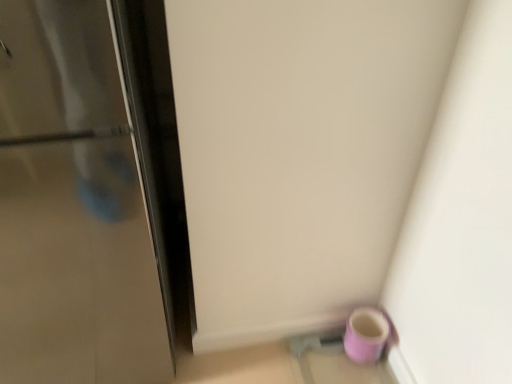
Image resolution: width=512 pixels, height=384 pixels. I want to click on matte purple mug at lower right, so click(x=365, y=334).

Describe the element at coordinates (365, 334) in the screenshot. This screenshot has height=384, width=512. I see `matte purple mug at lower right` at that location.

Describe the element at coordinates (72, 207) in the screenshot. This screenshot has width=512, height=384. I see `glossy metallic door at left` at that location.

Where is `glossy metallic door at left`? glossy metallic door at left is located at coordinates (72, 207).

Locate an element on the screen. The height and width of the screenshot is (384, 512). matte purple mug at lower right is located at coordinates (365, 334).

Which object is positioned more to the right, glossy metallic door at left or matte purple mug at lower right?

matte purple mug at lower right.

Is the position of glossy metallic door at left more distant than that of matte purple mug at lower right?

No, glossy metallic door at left is closer to the viewer.

Considering the points (15, 346) and (352, 327), which point is in front, point (15, 346) or point (352, 327)?

The point (352, 327) is more forward.

From the image's perspective, between glossy metallic door at left and matte purple mug at lower right, which one is located above?

glossy metallic door at left appears higher in the image.

From a real-world perspective, who is located lower, glossy metallic door at left or matte purple mug at lower right?

matte purple mug at lower right, from a real-world perspective.

Is glossy metallic door at left wider or thinner than matte purple mug at lower right?

Clearly, glossy metallic door at left has more width compared to matte purple mug at lower right.

Who is taller, glossy metallic door at left or matte purple mug at lower right?

Standing taller between the two is glossy metallic door at left.

Considering the sizes of objects glossy metallic door at left and matte purple mug at lower right in the image provided, who is smaller, glossy metallic door at left or matte purple mug at lower right?

Smaller between the two is matte purple mug at lower right.

Is glossy metallic door at left completely or partially outside of matte purple mug at lower right?

Absolutely, glossy metallic door at left is external to matte purple mug at lower right.

Are glossy metallic door at left and matte purple mug at lower right located far from each other?

No.

Is glossy metallic door at left oriented away from matte purple mug at lower right?

glossy metallic door at left does not have its back to matte purple mug at lower right.

How different are the orientations of glossy metallic door at left and matte purple mug at lower right in degrees?

There is a 90-degree angle between the facing directions of glossy metallic door at left and matte purple mug at lower right.

Identify the location of mug on the right of glossy metallic door at left. (365, 334).

Between matte purple mug at lower right and glossy metallic door at left, which one appears on the right side from the viewer's perspective?

matte purple mug at lower right.

Which object is closer to the camera, matte purple mug at lower right or glossy metallic door at left?

Positioned in front is glossy metallic door at left.

Is point (369, 329) less distant than point (24, 347)?

Yes, it is.

From the image's perspective, is matte purple mug at lower right positioned above or below glossy metallic door at left?

Based on their image positions, matte purple mug at lower right is located beneath glossy metallic door at left.

Based on the photo, from a real-world perspective, who is located higher, matte purple mug at lower right or glossy metallic door at left?

glossy metallic door at left.

Between matte purple mug at lower right and glossy metallic door at left, which one has smaller width?

Thinner between the two is matte purple mug at lower right.

Which of these two, matte purple mug at lower right or glossy metallic door at left, stands shorter?

Standing shorter between the two is matte purple mug at lower right.

Is matte purple mug at lower right bigger or smaller than glossy metallic door at left?

Considering their sizes, matte purple mug at lower right takes up less space than glossy metallic door at left.

Choose the correct answer: Is matte purple mug at lower right inside glossy metallic door at left or outside it?

matte purple mug at lower right cannot be found inside glossy metallic door at left.

Is matte purple mug at lower right next to glossy metallic door at left?

matte purple mug at lower right and glossy metallic door at left are clearly separated.

Is matte purple mug at lower right facing away from glossy metallic door at left?

That's not correct — matte purple mug at lower right is not looking away from glossy metallic door at left.

What's the angular difference between matte purple mug at lower right and glossy metallic door at left's facing directions?

They differ by 90 degrees in their facing directions.

In the image, there is a glossy metallic door at left. Find the location of `mug below it (from the image's perspective)`. mug below it (from the image's perspective) is located at coordinates (365, 334).

I want to click on mug directly beneath the glossy metallic door at left (from a real-world perspective), so click(365, 334).

Where is `door located on the left of matte purple mug at lower right`? Image resolution: width=512 pixels, height=384 pixels. door located on the left of matte purple mug at lower right is located at coordinates (72, 207).